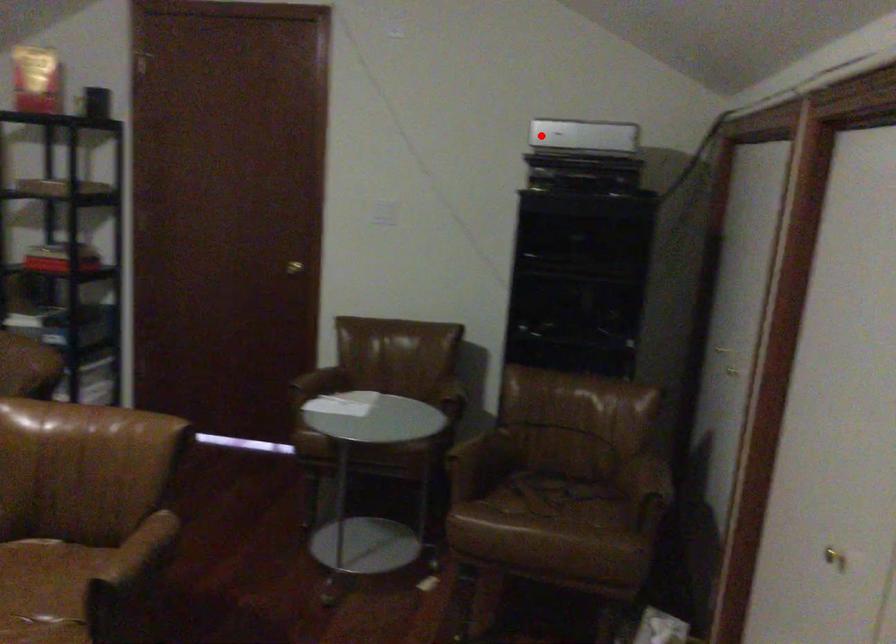
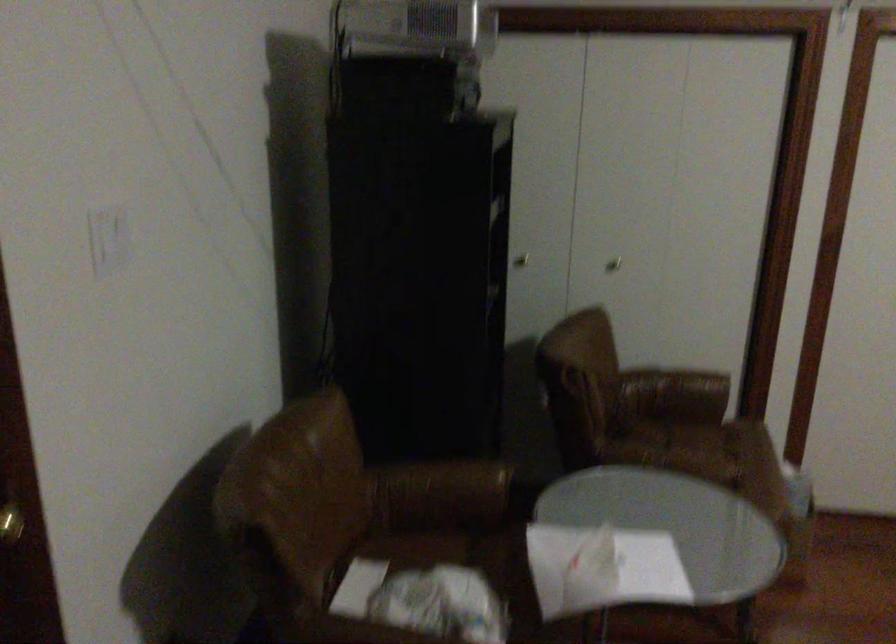
Find the pixel in the second image that matches the highlighted location in the first image.

(412, 26)